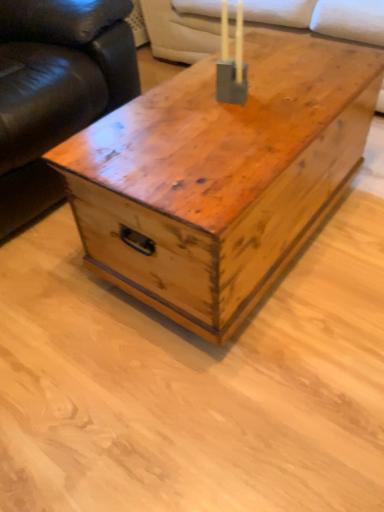
The height and width of the screenshot is (512, 384). What are the coordinates of `free spot to the right of matte gray concrete candle holder at center` in the screenshot? It's located at 291,94.